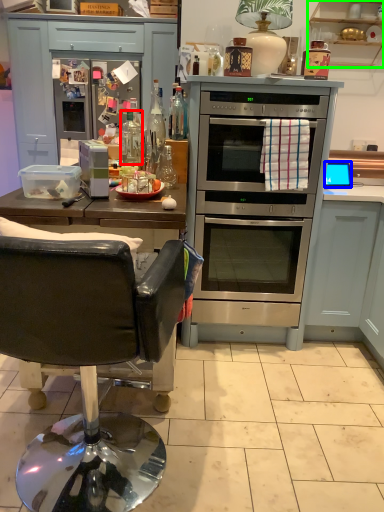
Question: Which object is the farthest from bottle (highlighted by a red box)? Choose among these: appliance (highlighted by a blue box) or cabinetry (highlighted by a green box).

Choices:
 (A) appliance
 (B) cabinetry

Answer: (B)